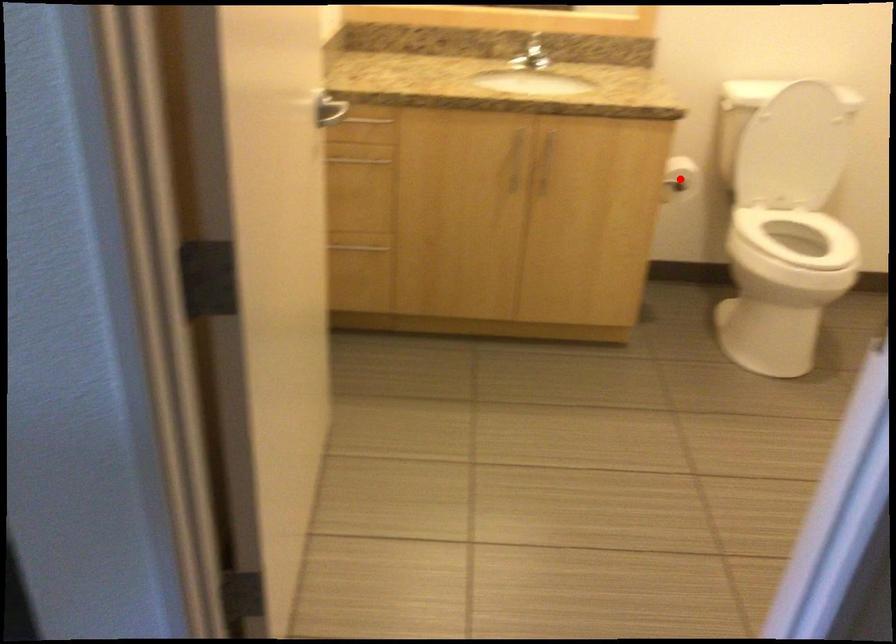
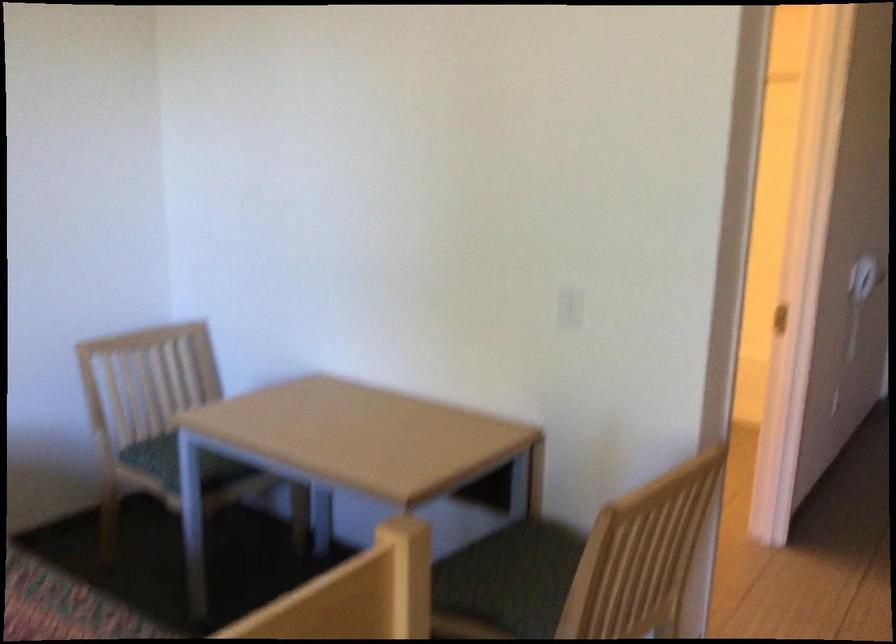
Question: I am providing you with two images of the same scene from different viewpoints. A red point is marked on the first image. Is the red point's position out of view in image 2?

Choices:
 (A) Yes
 (B) No

Answer: (A)